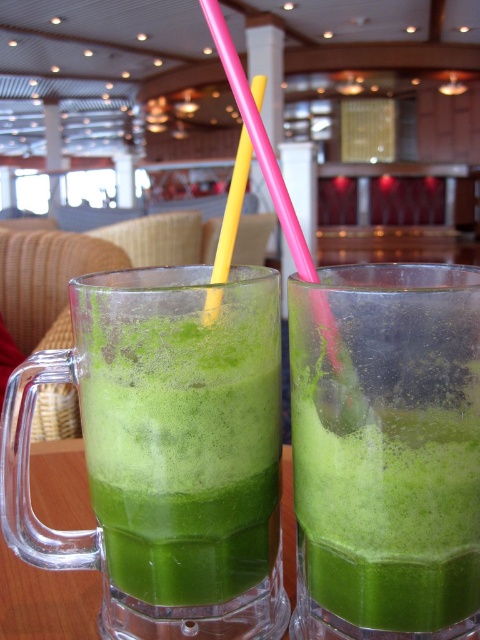
Question: Which object appears closest to the camera in this image?

Choices:
 (A) green frosted glass mug at left
 (B) yellow plastic straw at center

Answer: (B)

Question: Can you confirm if green frothy smoothie at center is positioned below yellow plastic straw at center?

Choices:
 (A) no
 (B) yes

Answer: (B)

Question: Which of the following is the farthest from the observer?

Choices:
 (A) green frothy smoothie at center
 (B) yellow plastic straw at center

Answer: (B)

Question: Is green frothy smoothie at center wider than green frosted glass mug at left?

Choices:
 (A) no
 (B) yes

Answer: (A)

Question: Estimate the real-world distances between objects in this image. Which object is closer to the yellow plastic straw at center?

Choices:
 (A) green frothy smoothie at center
 (B) green frosted glass mug at left

Answer: (A)

Question: Is green frothy smoothie at center above green frosted glass mug at left?

Choices:
 (A) yes
 (B) no

Answer: (B)